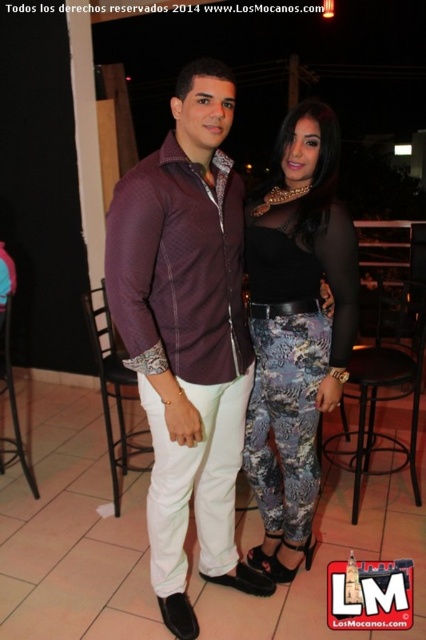
You are at a social event and want to hand a drink to the person wearing the matte purple shirt at center. There is a black metal bar stool at lower right nearby. Which object should you move closer to first to reach the person?

The matte purple shirt at center is closer to the viewer than the black metal bar stool at lower right, so you should move closer to the matte purple shirt at center first to reach the person.

You are a photographer setting up for an event. You notice the matte purple shirt at center and the black metal bar stool at lower right. Which object is closer to the left side of the frame?

The matte purple shirt at center is positioned on the left side of the black metal bar stool at lower right, so it is closer to the left side of the frame.